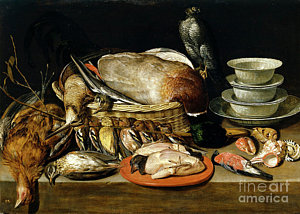
I want to click on basket, so click(168, 112).